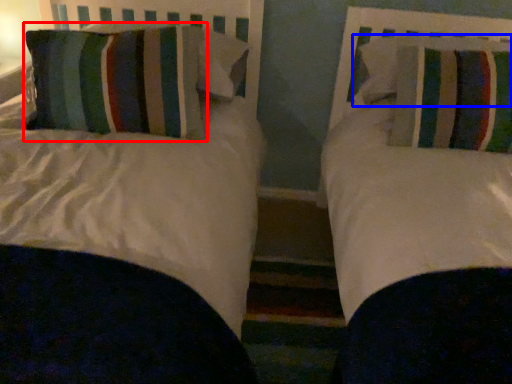
Question: Which point is closer to the camera, pillow (highlighted by a red box) or pillow (highlighted by a blue box)?

Choices:
 (A) pillow
 (B) pillow

Answer: (A)